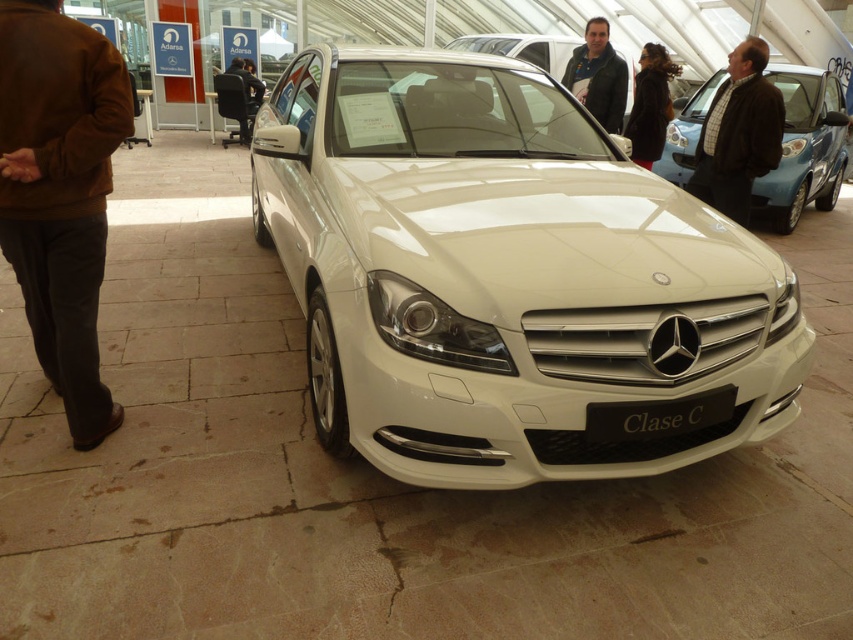
You are a salesperson at the Mercedes dealership. You need to approach the brown suede jacket at left and the brown plaid shirt at center to offer a test drive. In which order should you approach them from your current position in the showroom?

You should first approach the brown suede jacket at left and then the brown plaid shirt at center because the brown suede jacket at left is to the left of brown plaid shirt at center.

You are a fashion designer analyzing the clothing items in the showroom. You notice the brown suede jacket at left and the brown plaid shirt at center. Which clothing item appears taller in the image?

The brown suede jacket at left has a greater height compared to the brown plaid shirt at center, so the brown suede jacket at left appears taller.